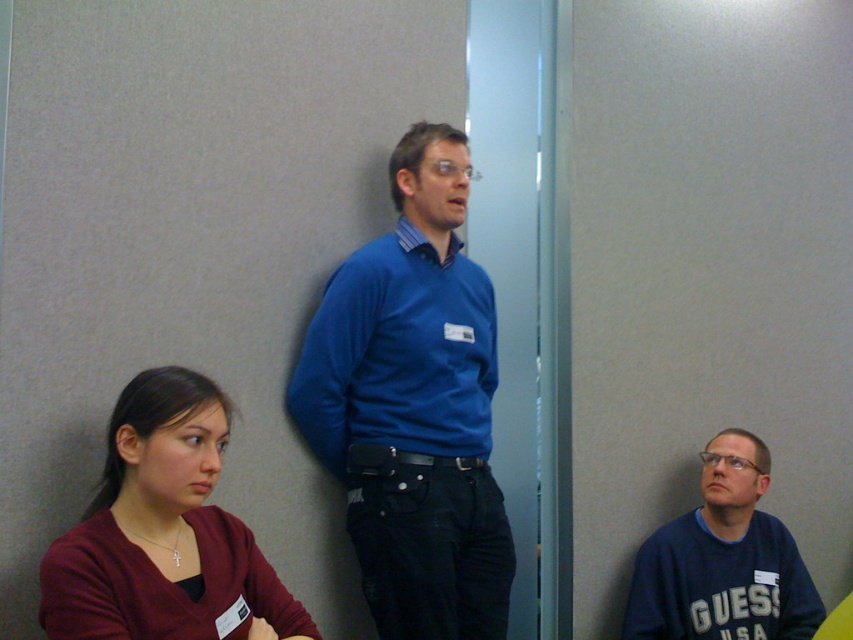
Question: Can you confirm if blue matte sweater at center is smaller than blue cotton sweatshirt at lower right?

Choices:
 (A) yes
 (B) no

Answer: (B)

Question: Which of the following is the farthest from the observer?

Choices:
 (A) (57, 634)
 (B) (345, 326)
 (C) (454, 332)
 (D) (724, 552)

Answer: (D)

Question: Is blue matte sweater at center closer to camera compared to blue smooth shirt at center?

Choices:
 (A) yes
 (B) no

Answer: (A)

Question: Does matte blue sweater at center have a larger size compared to blue smooth shirt at center?

Choices:
 (A) yes
 (B) no

Answer: (A)

Question: Which point is closer to the camera?

Choices:
 (A) matte blue sweater at center
 (B) maroon sweater at lower left
 (C) blue smooth shirt at center
 (D) blue matte sweater at center

Answer: (B)

Question: Which object appears farthest from the camera in this image?

Choices:
 (A) blue smooth shirt at center
 (B) matte blue sweater at center

Answer: (A)